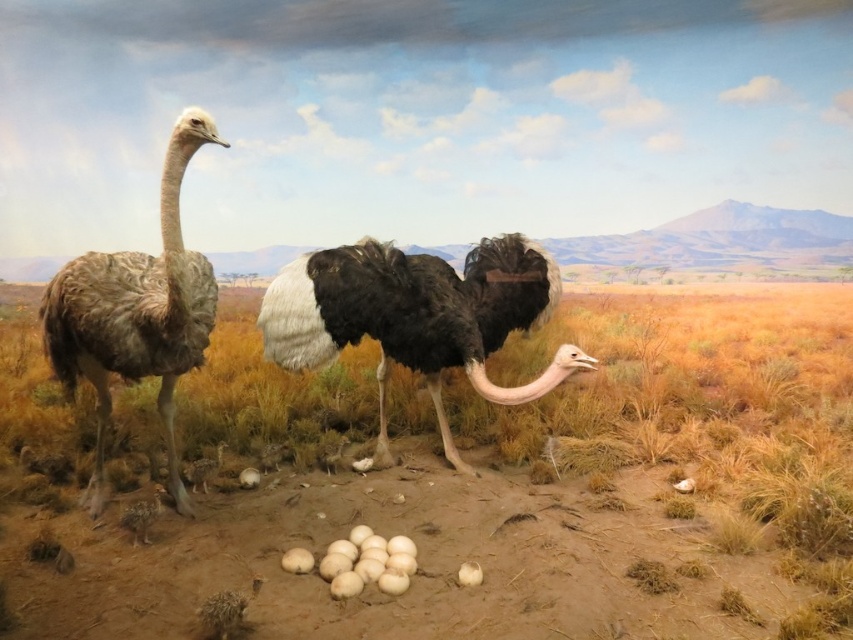
Can you confirm if brown sandy dirt at center is wider than black glossy feathers at center?

Yes, brown sandy dirt at center is wider than black glossy feathers at center.

Does brown sandy dirt at center come behind black glossy feathers at center?

No.

From the picture: Measure the distance between brown sandy dirt at center and camera.

The distance of brown sandy dirt at center from camera is 7.75 feet.

You are a GUI agent. You are given a task and a screenshot of the screen. Output one action in this format:
    pyautogui.click(x=<x>, y=<y>)
    Task: Click on the brown sandy dirt at center
    This screenshot has width=853, height=640.
    Given the screenshot: What is the action you would take?
    pyautogui.click(x=466, y=483)

Does point (305, 308) come closer to viewer compared to point (167, 356)?

No.

Does black glossy feathers at center have a greater width compared to brown feathered ostrich at left?

Indeed, black glossy feathers at center has a greater width compared to brown feathered ostrich at left.

Measure the distance between black glossy feathers at center and camera.

black glossy feathers at center and camera are 2.99 meters apart.

Identify the location of black glossy feathers at center. This screenshot has width=853, height=640. (416, 316).

Between brown sandy dirt at center and brown feathered ostrich at left, which one has less height?

With less height is brown sandy dirt at center.

Is brown sandy dirt at center to the left of brown feathered ostrich at left from the viewer's perspective?

Incorrect, brown sandy dirt at center is not on the left side of brown feathered ostrich at left.

Is point (624, 614) positioned after point (171, 154)?

That is True.

Image resolution: width=853 pixels, height=640 pixels. In order to click on brown sandy dirt at center in this screenshot , I will do `click(466, 483)`.